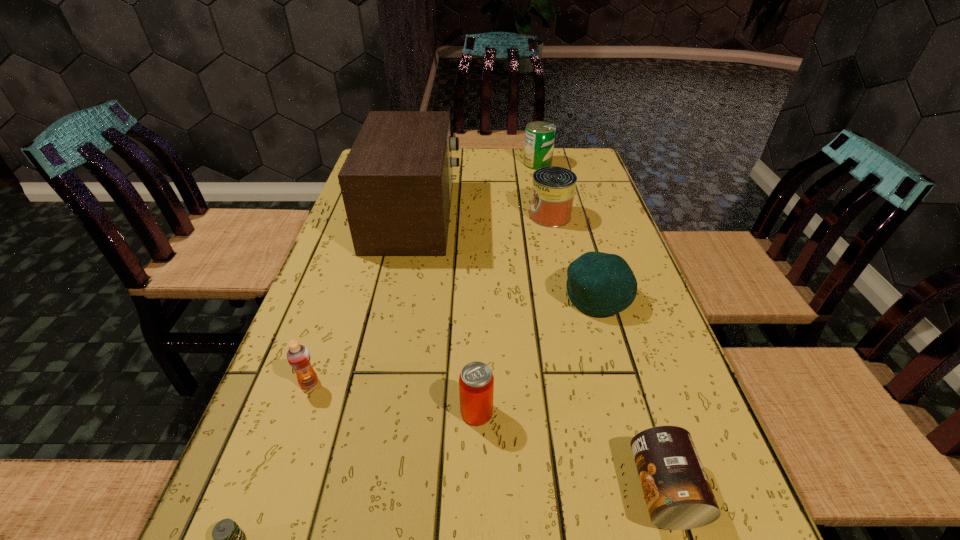
Locate an element on the screen. the tallest object is located at coordinates click(396, 182).

Where is `the farthest can`? Image resolution: width=960 pixels, height=540 pixels. the farthest can is located at coordinates (539, 137).

At what (x,y) coordinates should I click in order to perform the action: click on the second farthest can. Please return your answer as a coordinate pair (x, y). Looking at the image, I should click on (553, 187).

At what (x,y) coordinates should I click in order to perform the action: click on the fifth nearest object. Please return your answer as a coordinate pair (x, y). Looking at the image, I should click on click(599, 284).

The width and height of the screenshot is (960, 540). Identify the location of orange juice. (298, 356).

Locate an element on the screen. the leftmost can is located at coordinates (476, 382).

Image resolution: width=960 pixels, height=540 pixels. What are the coordinates of `the third nearest object` in the screenshot? It's located at (476, 382).

The height and width of the screenshot is (540, 960). Find the location of `the shortest can`. the shortest can is located at coordinates (678, 495).

This screenshot has height=540, width=960. In order to click on the second shortest object in this screenshot , I will do `click(678, 495)`.

Find the location of a particular element. This screenshot has width=960, height=540. vacant space situated 0.340m on the front-facing side of the tallest object is located at coordinates click(577, 215).